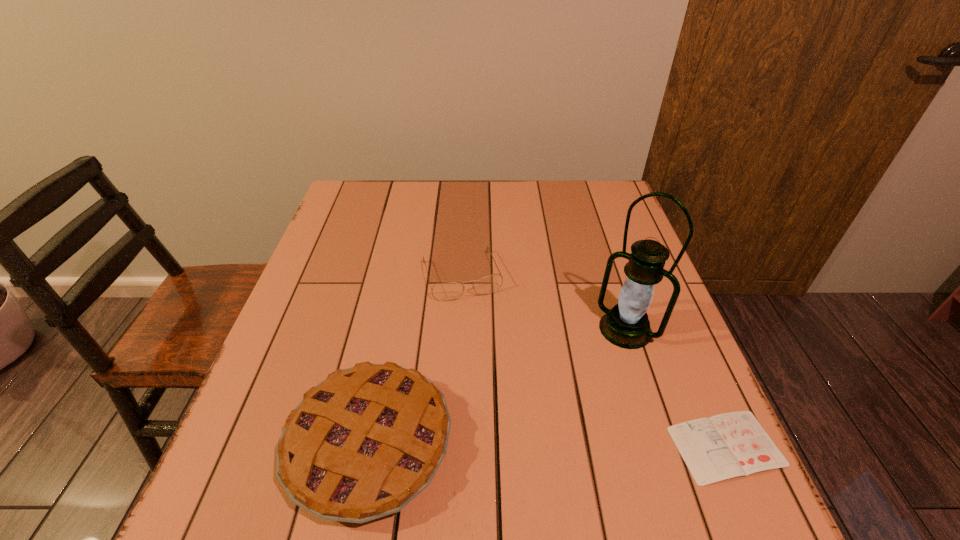
This screenshot has width=960, height=540. I want to click on empty space that is in between the second shortest object and the tallest object, so click(543, 302).

Find the location of `free space between the shortest object and the second shortest object`. free space between the shortest object and the second shortest object is located at coordinates (594, 361).

Locate an element on the screen. The width and height of the screenshot is (960, 540). free spot between the lantern and the second tallest object is located at coordinates (497, 387).

Find the location of a particular element. This screenshot has width=960, height=540. blank region between the third shortest object and the lantern is located at coordinates (497, 387).

Where is `blank region between the shortest object and the second shortest object`? This screenshot has width=960, height=540. blank region between the shortest object and the second shortest object is located at coordinates (594, 361).

Locate an element on the screen. The image size is (960, 540). object that is the third closest to the tallest object is located at coordinates (362, 444).

Choose which object is the nearest neighbor to the shortest object. Please provide its 2D coordinates. Your answer should be formatted as a tuple, i.e. [(x, y)], where the tuple contains the x and y coordinates of a point satisfying the conditions above.

[(626, 325)]

The width and height of the screenshot is (960, 540). In order to click on free space in the image that satisfies the following two spatial constraints: 1. on the front side of the shortest object; 2. on the left side of the pie in this screenshot , I will do `click(370, 447)`.

Find the location of a particular element. The image size is (960, 540). free space that satisfies the following two spatial constraints: 1. on the front side of the farthest object; 2. on the right side of the lantern is located at coordinates (459, 329).